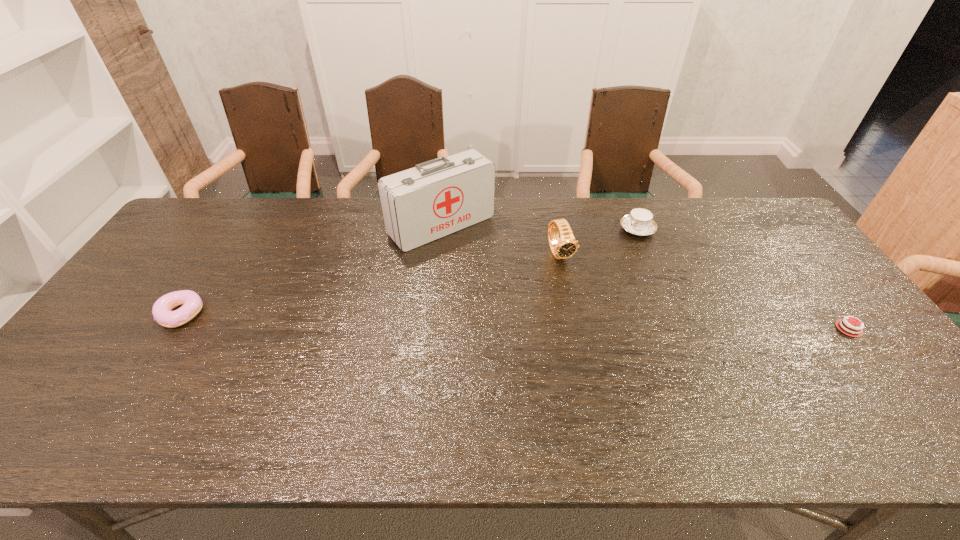
Locate an element on the screen. vacant space positioned 0.370m on the back of the leftmost object is located at coordinates (242, 220).

You are a GUI agent. You are given a task and a screenshot of the screen. Output one action in this format:
    pyautogui.click(x=<x>, y=<y>)
    Task: Click on the vacant space situated on the back of the chocolate cake
    
    Given the screenshot: What is the action you would take?
    pyautogui.click(x=814, y=284)

Image resolution: width=960 pixels, height=540 pixels. What are the coordinates of `blank area located on the front-facing side of the first-aid kit` in the screenshot? It's located at click(x=540, y=318).

Locate an element on the screen. The image size is (960, 540). free spot located 0.240m on the front-facing side of the first-aid kit is located at coordinates (516, 294).

At what (x,y) coordinates should I click in order to perform the action: click on free spot located on the front-facing side of the first-aid kit. Please return your answer as a coordinate pair (x, y). Looking at the image, I should click on (489, 266).

Find the location of a particular element. The height and width of the screenshot is (540, 960). free space located on the face of the third object from right to left is located at coordinates (577, 285).

At what (x,y) coordinates should I click in order to perform the action: click on free location located 0.350m on the face of the third object from right to left. Please return your answer as a coordinate pair (x, y). This screenshot has width=960, height=540. Looking at the image, I should click on (620, 359).

Locate an element on the screen. free space located 0.080m on the face of the third object from right to left is located at coordinates click(x=577, y=285).

Identify the location of vacant area situated 0.370m on the side with the handle of the teacup. Image resolution: width=960 pixels, height=540 pixels. (554, 293).

The height and width of the screenshot is (540, 960). Find the location of `free location located 0.150m on the side with the handle of the teacup`. free location located 0.150m on the side with the handle of the teacup is located at coordinates (600, 258).